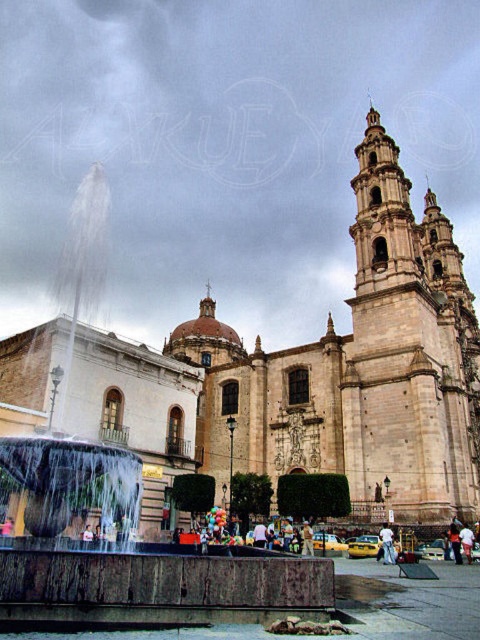
Question: Does beige stone church at center have a smaller size compared to light blue jeans at center?

Choices:
 (A) yes
 (B) no

Answer: (B)

Question: Which object is closer to the camera taking this photo?

Choices:
 (A) light blue jeans at center
 (B) beige stone church at center

Answer: (A)

Question: Does beige stone church at center have a smaller size compared to light blue jeans at center?

Choices:
 (A) no
 (B) yes

Answer: (A)

Question: Which point is closer to the camera?

Choices:
 (A) (35, 403)
 (B) (381, 556)

Answer: (B)

Question: Does beige stone church at center lie in front of light blue jeans at center?

Choices:
 (A) yes
 (B) no

Answer: (B)